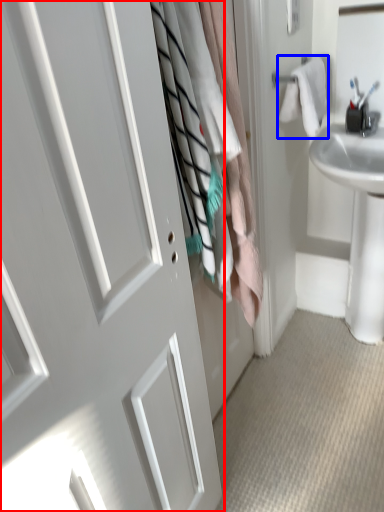
Question: Among these objects, which one is nearest to the camera, door (highlighted by a red box) or bath towel (highlighted by a blue box)?

Choices:
 (A) door
 (B) bath towel

Answer: (A)